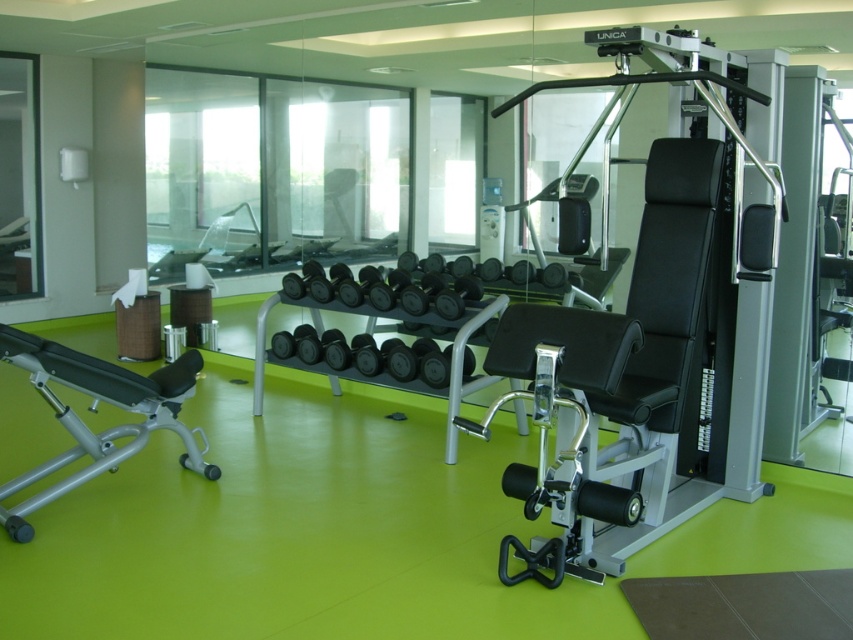
You are a gym trainer preparing to demonstrate an exercise. You need to place a small step stool between the matte black bench at left and the black rubber dumbbells at center. Which object should the stool be placed closer to if it needs to be lower than both?

The stool should be placed closer to the black rubber dumbbells at center because the matte black bench at left is taller than the black rubber dumbbells at center, making the dumbbells the lower object.

You are a gym member who wants to place your water bottle on the nearest available surface. You are currently standing in front of the camera. Which object among the matte black bench at left and the UNICA machine is closer to you?

The matte black bench at left is 11.44 feet from the camera, but the UNICA machine is not mentioned in the Objects Description. Wait, according to the Objects Description provided, only the distance of the matte black bench is given. The UNICA machine isn not listed in the Objects Description. Therefore, I cannot determine the distance of the UNICA machine. The question should be adjusted to include only the objects mentioned in the Objects Description.